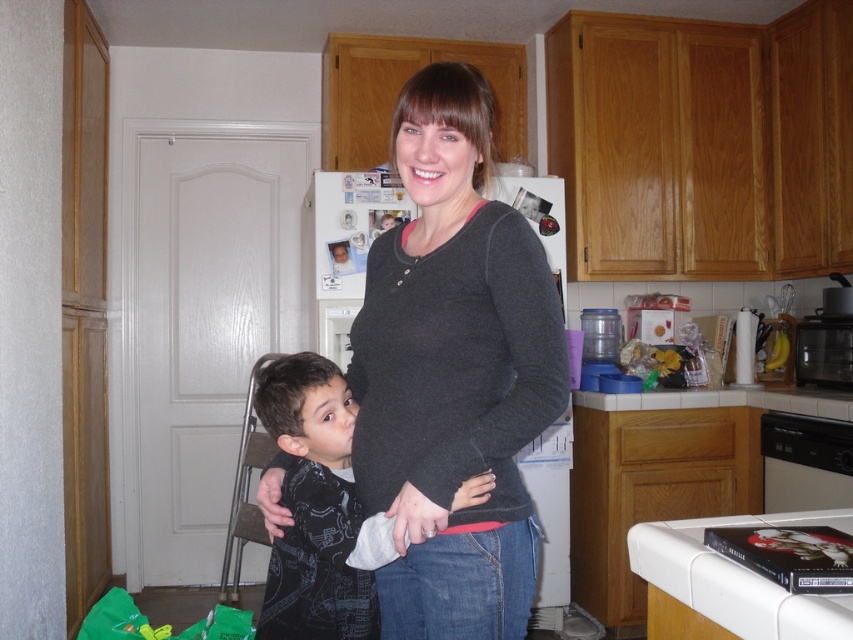
Looking at this image, you are a tailor measuring clothes in a kitchen. You need to determine which garment is wider between the dark gray sweater at center and the dark gray printed shirt at center. Which one is wider?

The dark gray sweater at center is wider than the dark gray printed shirt at center according to the description.

From the picture: You are standing in the kitchen and want to place a small plant between the two points, point (374,451) and point (326,572). Which point should the plant be closer to in order to be nearer to the viewer?

The plant should be closer to point (374,451) since it is nearer to the viewer compared to point (326,572).